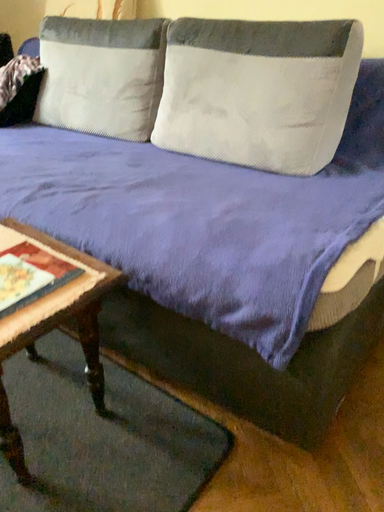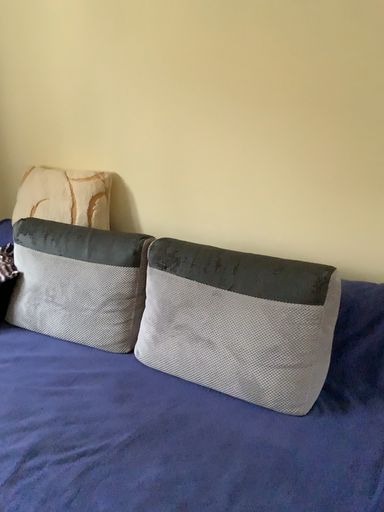
Question: How did the camera likely rotate when shooting the video?

Choices:
 (A) rotated upward
 (B) rotated downward

Answer: (A)